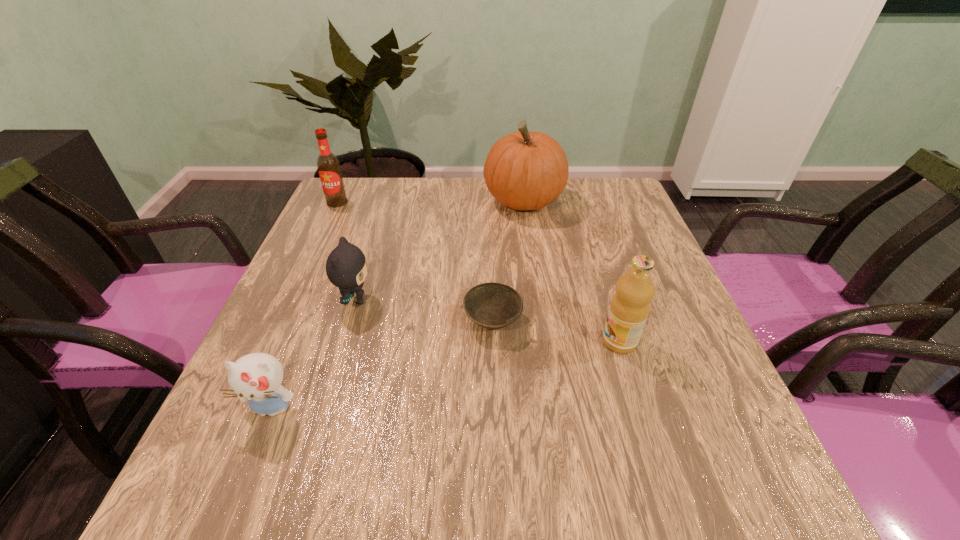
Find the location of `beer bottle present at the left edge`. beer bottle present at the left edge is located at coordinates (328, 165).

Image resolution: width=960 pixels, height=540 pixels. I want to click on object that is positioned at the right edge, so click(x=629, y=308).

The width and height of the screenshot is (960, 540). Identify the location of object present at the far left corner. (328, 165).

I want to click on vacant space at the far edge of the desktop, so click(459, 193).

Image resolution: width=960 pixels, height=540 pixels. In the image, there is a desktop. In order to click on vacant space at the near edge in this screenshot , I will do `click(409, 465)`.

Where is `vacant region at the left edge`? vacant region at the left edge is located at coordinates tap(339, 332).

This screenshot has width=960, height=540. What are the coordinates of `vacant point at the right edge` in the screenshot? It's located at (632, 377).

Image resolution: width=960 pixels, height=540 pixels. In the image, there is a desktop. Find the location of `vacant space at the far left corner`. vacant space at the far left corner is located at coordinates (354, 191).

The height and width of the screenshot is (540, 960). Find the location of `free space at the far right corner of the desktop`. free space at the far right corner of the desktop is located at coordinates (610, 198).

Identify the location of free space that is in between the shortest object and the left kitten. (382, 364).